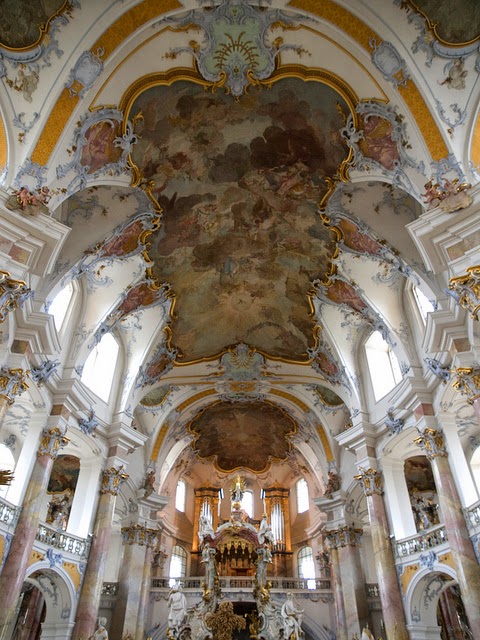
Find the location of a particular element. Image resolution: width=480 pixels, height=640 pixels. possible staircase is located at coordinates (178, 620), (310, 624).